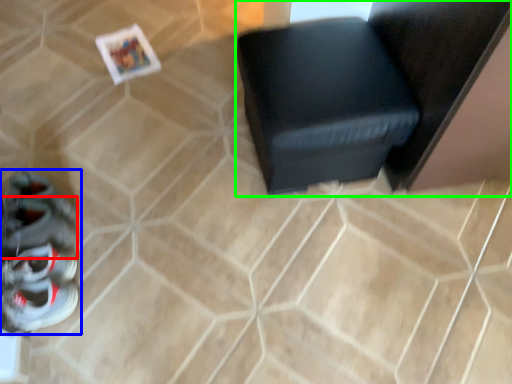
Question: Which object is positioned closest to shoe (highlighted by a red box)? Select from footwear (highlighted by a blue box) and furniture (highlighted by a green box).

Choices:
 (A) footwear
 (B) furniture

Answer: (A)